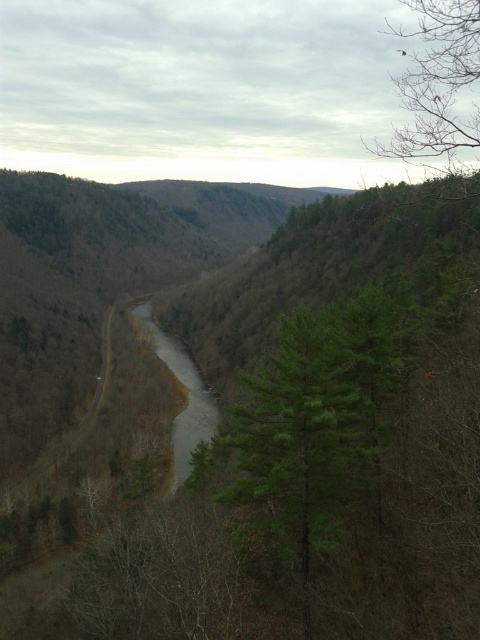
Question: Among these objects, which one is nearest to the camera?

Choices:
 (A) gray smooth creek at center
 (B) green leafy tree at upper right

Answer: (B)

Question: Is green leafy tree at upper right above gray smooth creek at center?

Choices:
 (A) yes
 (B) no

Answer: (A)

Question: Is green leafy tree at upper right below gray smooth creek at center?

Choices:
 (A) no
 (B) yes

Answer: (A)

Question: Is green leafy tree at upper right further to the viewer compared to gray smooth creek at center?

Choices:
 (A) yes
 (B) no

Answer: (B)